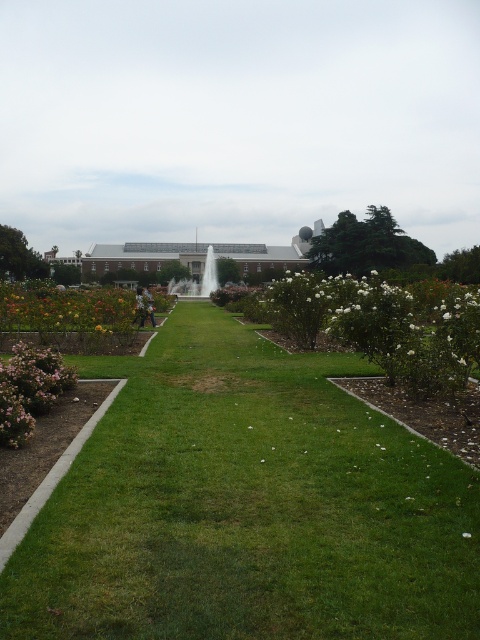
You are standing at the entrance of the garden and want to water the pink matte bush at lower left. If your watering can has a range of 5 meters, can you water it from where you are standing?

The pink matte bush at lower left is 6.25 meters away from the viewer, which is beyond the watering can range of 5 meters. You need to move closer to water it.

You are standing at the fountain in the center of the garden. You want to walk towards the building in the background. Which point, point (44, 525) or point (26, 388), is closer to you as you face the building?

Point (44, 525) is closer to you because it is nearer to the viewer compared to point (26, 388).